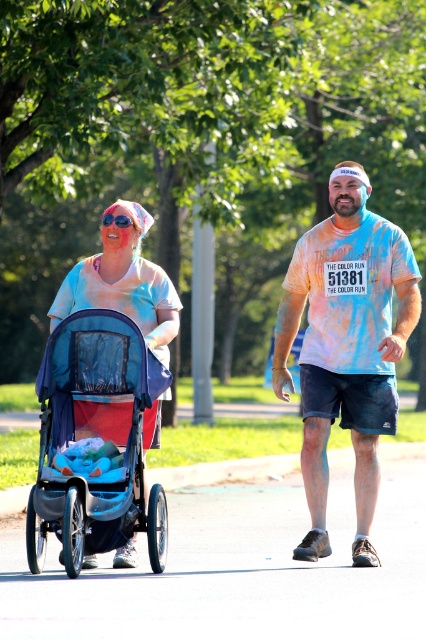
Is paint-splattered t-shirt at center shorter than speckled tie-dye t-shirt at center?

Correct, paint-splattered t-shirt at center is not as tall as speckled tie-dye t-shirt at center.

Which is below, paint-splattered t-shirt at center or speckled tie-dye t-shirt at center?

paint-splattered t-shirt at center

Image resolution: width=426 pixels, height=640 pixels. Describe the element at coordinates (347, 344) in the screenshot. I see `paint-splattered t-shirt at center` at that location.

Locate an element on the screen. This screenshot has width=426, height=640. paint-splattered t-shirt at center is located at coordinates (347, 344).

Does white rubber stroller at lower left have a greater height compared to paint-splattered t-shirt at center?

No.

The image size is (426, 640). What do you see at coordinates (239, 568) in the screenshot?
I see `white rubber stroller at lower left` at bounding box center [239, 568].

Between point (279, 627) and point (377, 248), which one is positioned behind?

Positioned behind is point (377, 248).

Identify the location of white rubber stroller at lower left. (239, 568).

The height and width of the screenshot is (640, 426). Describe the element at coordinates (345, 346) in the screenshot. I see `speckled tie-dye t-shirt at center` at that location.

Who is more forward, (304,264) or (63,342)?

Point (63,342) is more forward.

Who is more forward, (x=391, y=284) or (x=45, y=536)?

Point (x=45, y=536) is in front.

Where is `speckled tie-dye t-shirt at center`? speckled tie-dye t-shirt at center is located at coordinates (345, 346).